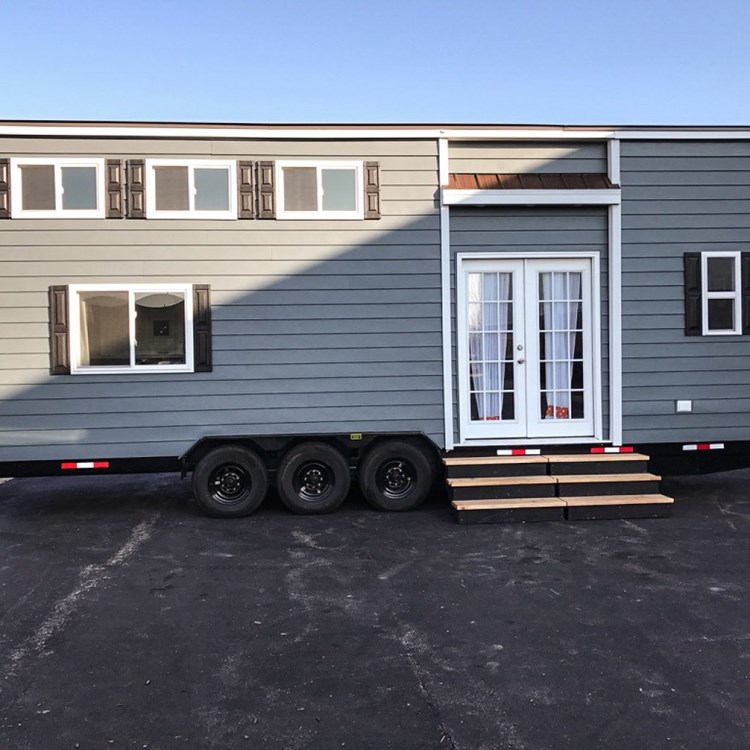
Identify the location of doors. click(520, 337), click(528, 350).